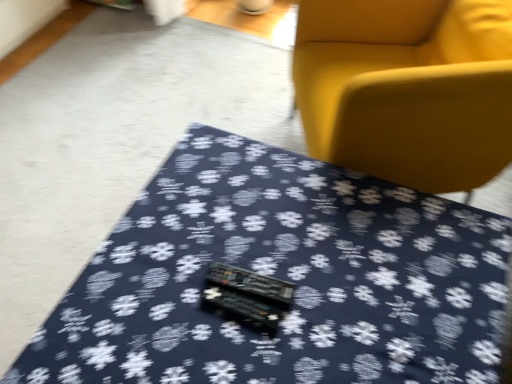
Question: Visually, is dark blue fabric at center positioned to the left or to the right of matte yellow armchair at upper right?

Choices:
 (A) left
 (B) right

Answer: (A)

Question: Considering the positions of dark blue fabric at center and matte yellow armchair at upper right in the image, is dark blue fabric at center taller or shorter than matte yellow armchair at upper right?

Choices:
 (A) short
 (B) tall

Answer: (A)

Question: Looking at their shapes, would you say dark blue fabric at center is wider or thinner than matte yellow armchair at upper right?

Choices:
 (A) thin
 (B) wide

Answer: (B)

Question: Does point (359, 54) appear closer or farther from the camera than point (506, 244)?

Choices:
 (A) closer
 (B) farther

Answer: (B)

Question: Considering the positions of matte yellow armchair at upper right and dark blue fabric at center in the image, is matte yellow armchair at upper right taller or shorter than dark blue fabric at center?

Choices:
 (A) short
 (B) tall

Answer: (B)

Question: From the image's perspective, is matte yellow armchair at upper right located above or below dark blue fabric at center?

Choices:
 (A) below
 (B) above

Answer: (B)

Question: Is matte yellow armchair at upper right bigger or smaller than dark blue fabric at center?

Choices:
 (A) small
 (B) big

Answer: (B)